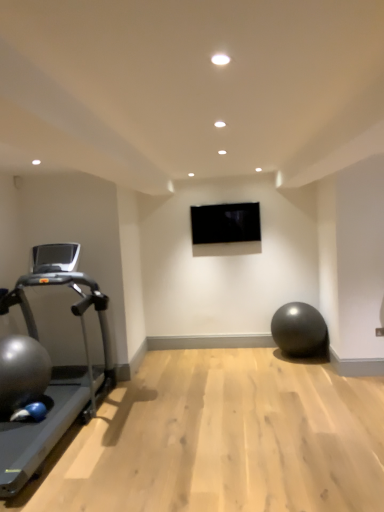
Question: Considering the positions of silver metallic treadmill at left and black glossy tv at center in the image, is silver metallic treadmill at left taller or shorter than black glossy tv at center?

Choices:
 (A) short
 (B) tall

Answer: (B)

Question: Is silver metallic treadmill at left spatially inside black glossy tv at center, or outside of it?

Choices:
 (A) outside
 (B) inside

Answer: (A)

Question: Considering the real-world distances, which object is closest to the black glossy tv at center?

Choices:
 (A) matte black ball at lower right, which is the second ball in front-to-back order
 (B) silver metallic treadmill at left
 (C) shiny metallic ball at left, which is the first ball in left-to-right order

Answer: (A)

Question: Which of these objects is positioned closest to the matte black ball at lower right, which is the second ball in front-to-back order?

Choices:
 (A) shiny metallic ball at left, which appears as the second ball when viewed from the right
 (B) silver metallic treadmill at left
 (C) black glossy tv at center

Answer: (C)